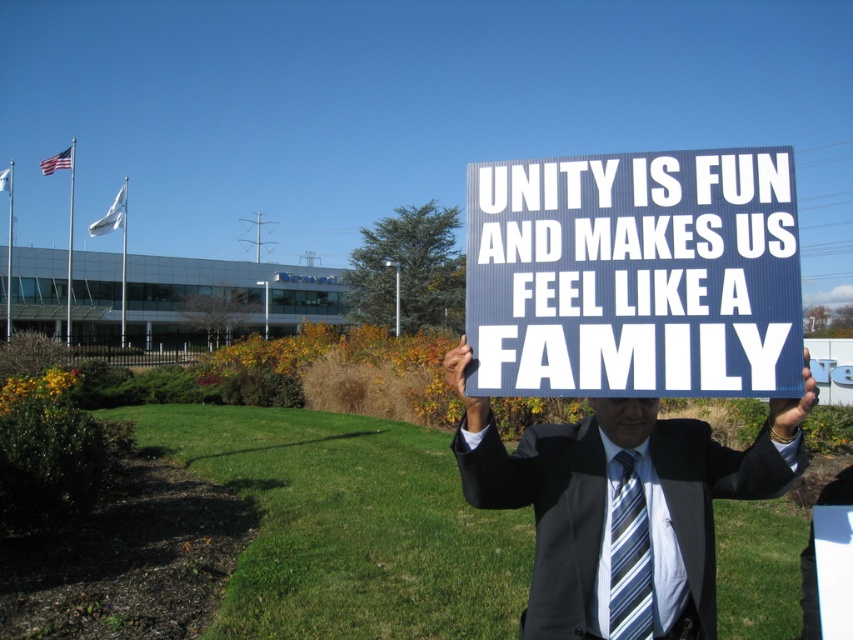
Does point (619, 268) lie behind point (585, 497)?

No.

Does blue corrugated plastic sign at center appear under dark gray suit at center?

Incorrect, blue corrugated plastic sign at center is not positioned below dark gray suit at center.

Is point (763, 390) farther from viewer compared to point (666, 509)?

No, it is in front of (666, 509).

Image resolution: width=853 pixels, height=640 pixels. What are the coordinates of `blue corrugated plastic sign at center` in the screenshot? It's located at (634, 275).

Which is more to the right, blue corrugated plastic sign at center or striped fabric tie at center?

striped fabric tie at center

You are a GUI agent. You are given a task and a screenshot of the screen. Output one action in this format:
    pyautogui.click(x=<x>, y=<y>)
    Task: Click on the blue corrugated plastic sign at center
    This screenshot has width=853, height=640.
    Given the screenshot: What is the action you would take?
    pyautogui.click(x=634, y=275)

Which is more to the left, dark gray suit at center or striped fabric tie at center?

Positioned to the left is dark gray suit at center.

Is dark gray suit at center taller than striped fabric tie at center?

Yes, dark gray suit at center is taller than striped fabric tie at center.

Is point (785, 456) more distant than point (627, 614)?

No, (785, 456) is in front of (627, 614).

Identify the location of dark gray suit at center. This screenshot has width=853, height=640. (621, 502).